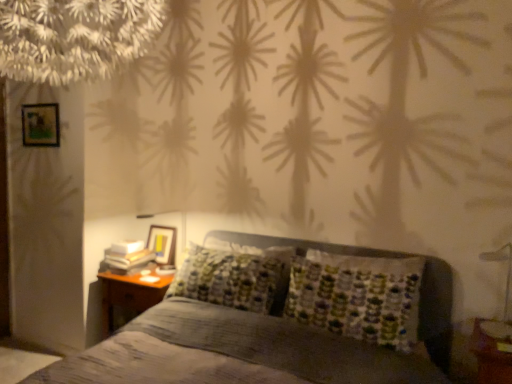
Image resolution: width=512 pixels, height=384 pixels. Identify the location of vacant space situated above woodennightstand at lower left (from a real-world perspective). (146, 273).